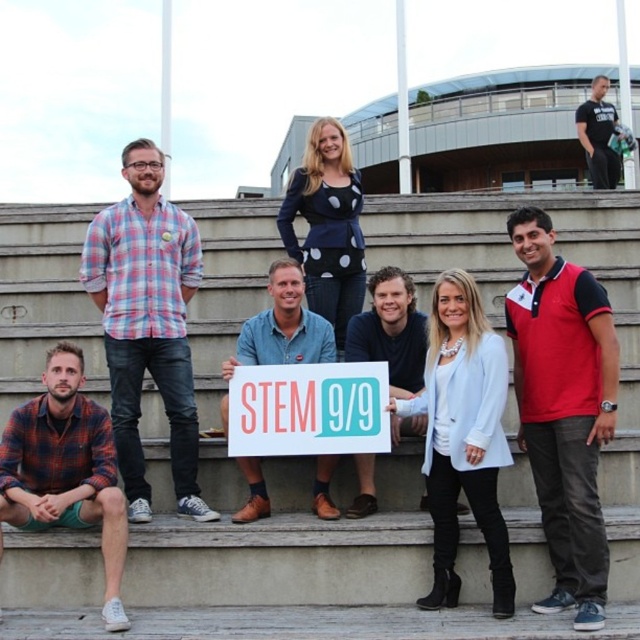
Which is behind, point (576, 472) or point (589, 166)?

Positioned behind is point (589, 166).

Can you confirm if red cotton polo shirt at right is positioned above black cotton t-shirt at upper right?

No.

Between point (566, 276) and point (582, 131), which one is positioned behind?

The point (582, 131) is more distant.

Identify the location of red cotton polo shirt at right. This screenshot has height=640, width=640. (563, 408).

Between point (100, 292) and point (291, 340), which one is positioned in front?

Point (291, 340)

Which is more to the left, plaid shirt at left or blue denim shirt at center?

plaid shirt at left is more to the left.

Between point (112, 269) and point (248, 480), which one is positioned behind?

The point (112, 269) is behind.

Find the location of `plaid shirt at left`. plaid shirt at left is located at coordinates (147, 323).

Is the position of light blue fabric jacket at center more distant than that of matte white sign at center?

No.

Does point (499, 385) come closer to viewer compared to point (326, 445)?

Yes, point (499, 385) is closer to viewer.

Where is `light blue fabric jacket at center`? The image size is (640, 640). light blue fabric jacket at center is located at coordinates (461, 435).